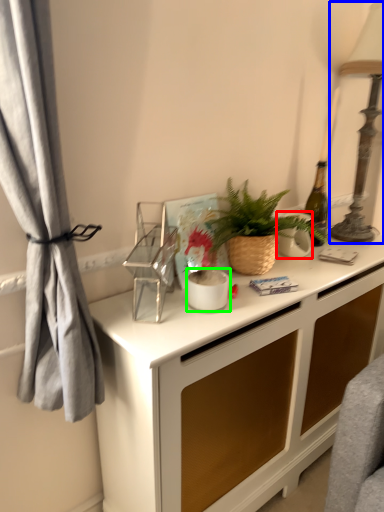
Question: Which is nearer to the appliance (highlighted by a red box)? table lamp (highlighted by a blue box) or appliance (highlighted by a green box).

Choices:
 (A) table lamp
 (B) appliance

Answer: (A)